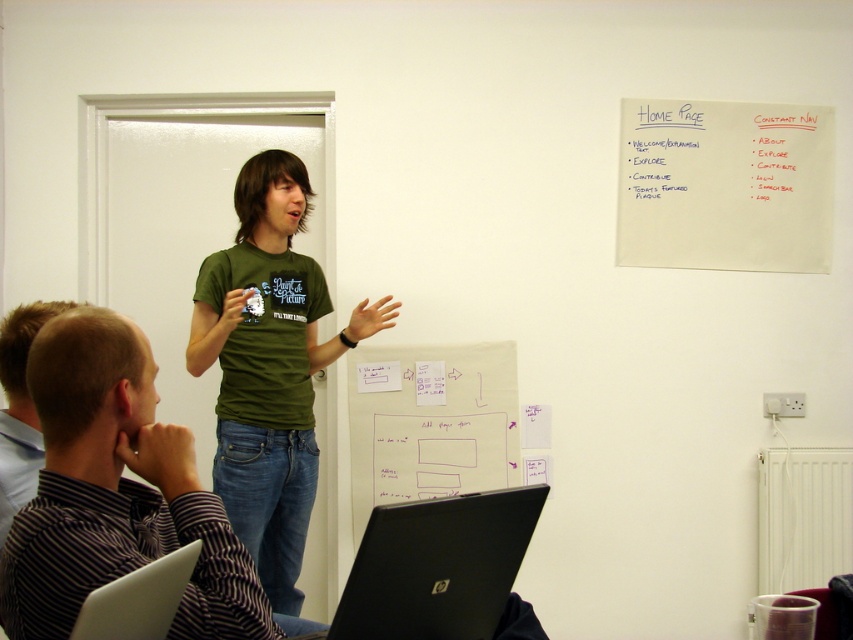
Is white paper at center bigger than white glossy laptop at lower left?

Correct, white paper at center is larger in size than white glossy laptop at lower left.

Does white paper at center have a greater height compared to white glossy laptop at lower left?

Indeed, white paper at center has a greater height compared to white glossy laptop at lower left.

What are the coordinates of `white paper at center` in the screenshot? It's located at (430, 422).

Between green matte shirt at center and white glossy laptop at lower left, which one is positioned higher?

green matte shirt at center is above.

How distant is green matte shirt at center from white glossy laptop at lower left?

The distance of green matte shirt at center from white glossy laptop at lower left is 7.10 inches.

What do you see at coordinates (115, 492) in the screenshot? I see `green matte shirt at center` at bounding box center [115, 492].

This screenshot has width=853, height=640. In order to click on green matte shirt at center in this screenshot , I will do `click(115, 492)`.

Can you confirm if green matte shirt at center is bigger than green t-shirt at center?

Incorrect, green matte shirt at center is not larger than green t-shirt at center.

At what (x,y) coordinates should I click in order to perform the action: click on green matte shirt at center. Please return your answer as a coordinate pair (x, y). The image size is (853, 640). Looking at the image, I should click on click(x=115, y=492).

Find the location of a particular element. The width and height of the screenshot is (853, 640). green matte shirt at center is located at coordinates (115, 492).